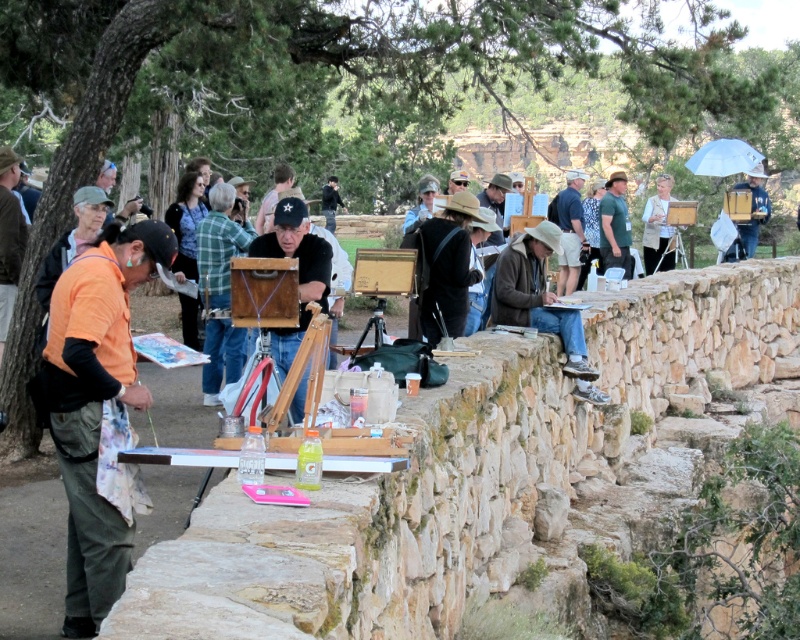
Who is shorter, wooden easel at center or dark blue jeans at center?

With less height is wooden easel at center.

Where is `wooden easel at center`? The image size is (800, 640). wooden easel at center is located at coordinates (381, 284).

Locate an element on the screen. This screenshot has height=640, width=800. wooden easel at center is located at coordinates (381, 284).

Which is in front, point (286, 353) or point (770, 212)?

Point (286, 353) is in front.

Is matte black cap at center in front of matte black easel at upper center?

Yes, it is in front of matte black easel at upper center.

Find the location of a particular element. The image size is (800, 640). matte black cap at center is located at coordinates (298, 272).

Is dark blue jeans at center shorter than matte black easel at upper center?

Yes.

Is point (580, 236) less distant than point (738, 225)?

Yes, it is in front of point (738, 225).

The height and width of the screenshot is (640, 800). In order to click on dark blue jeans at center in this screenshot , I will do `click(570, 230)`.

The width and height of the screenshot is (800, 640). Identify the location of dark blue jeans at center. (570, 230).